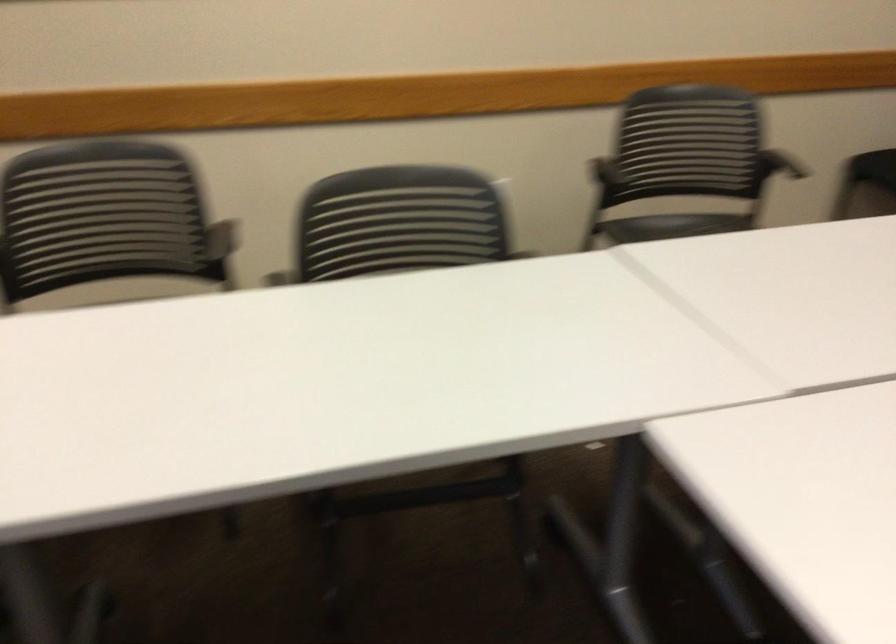
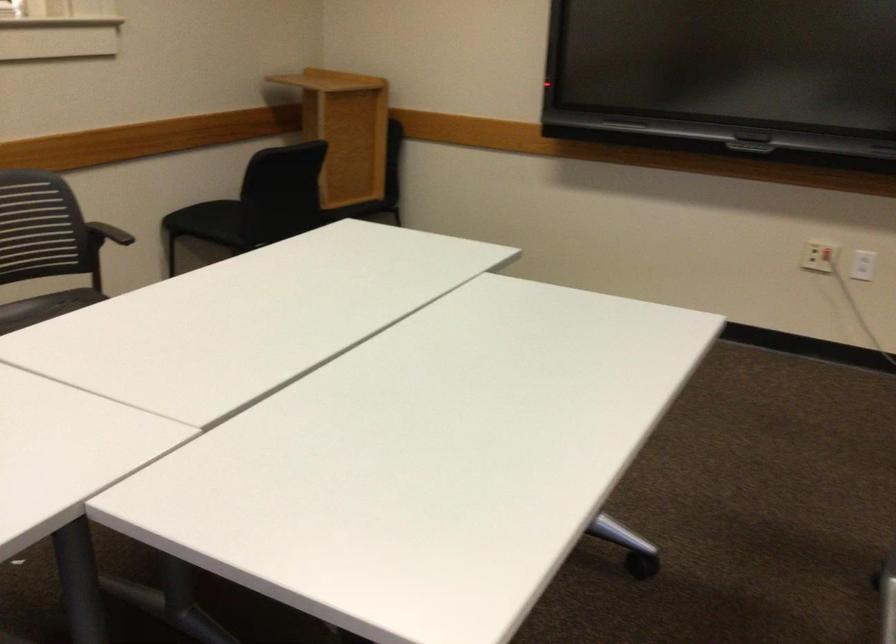
Question: How did the camera likely rotate?

Choices:
 (A) Left
 (B) Right
 (C) Up
 (D) Down

Answer: (B)